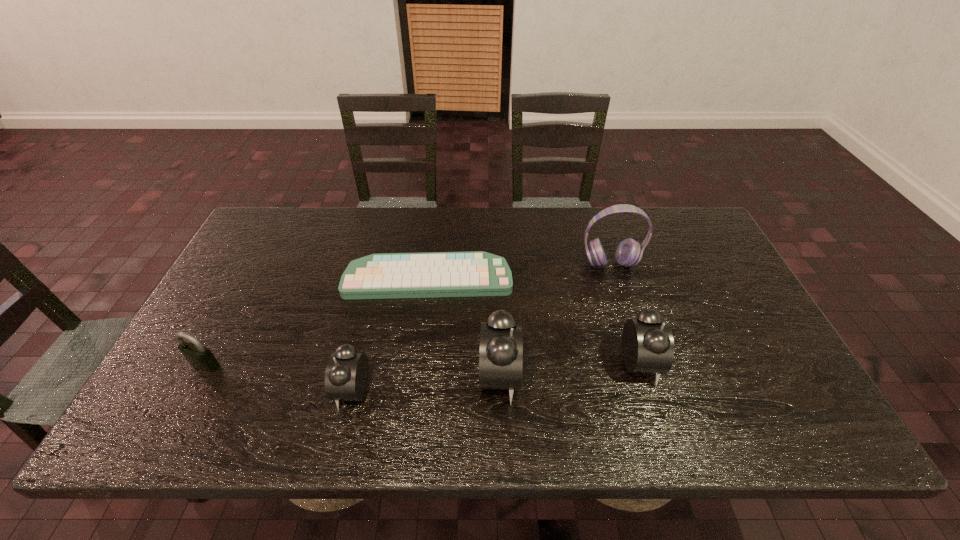
What are the coordinates of `the second closest object relative to the second shortest alarm clock` in the screenshot? It's located at (629, 252).

Locate an element on the screen. This screenshot has width=960, height=540. alarm clock that is the closest to the shortest alarm clock is located at coordinates (501, 355).

At what (x,y) coordinates should I click in order to perform the action: click on alarm clock object that ranks as the closest to the second alarm clock from right to left. Please return your answer as a coordinate pair (x, y). Looking at the image, I should click on [x=647, y=342].

Where is `vacant region that satisfies the following two spatial constraints: 1. on the headband and ear cups of the headset; 2. on the front side of the leftmost alarm clock`? The width and height of the screenshot is (960, 540). vacant region that satisfies the following two spatial constraints: 1. on the headband and ear cups of the headset; 2. on the front side of the leftmost alarm clock is located at coordinates (650, 389).

What are the coordinates of `vacant region that satisfies the following two spatial constraints: 1. on the headband and ear cups of the headset; 2. on the front side of the second tallest alarm clock` in the screenshot? It's located at (641, 364).

The height and width of the screenshot is (540, 960). Find the location of `free point that satisfies the following two spatial constraints: 1. on the back side of the leftmost object; 2. on the right side of the computer keyboard`. free point that satisfies the following two spatial constraints: 1. on the back side of the leftmost object; 2. on the right side of the computer keyboard is located at coordinates (252, 278).

You are a GUI agent. You are given a task and a screenshot of the screen. Output one action in this format:
    pyautogui.click(x=<x>, y=<y>)
    Task: Click on the free region that satisfies the following two spatial constraints: 1. on the headband and ear cups of the headset; 2. on the front side of the shortest alarm clock
    The height and width of the screenshot is (540, 960).
    Given the screenshot: What is the action you would take?
    pyautogui.click(x=650, y=389)